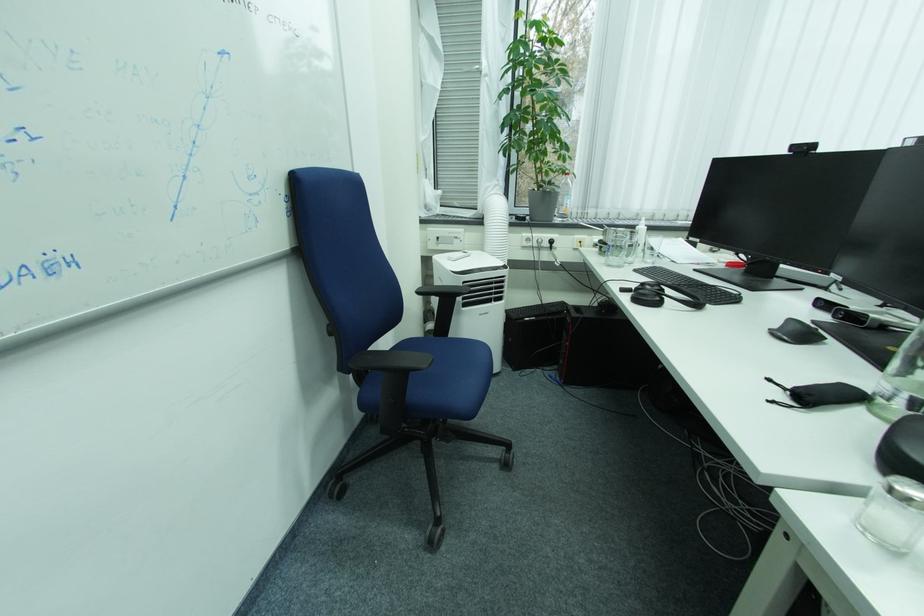
Locate an element on the screen. The image size is (924, 616). black drawstring pouch is located at coordinates (819, 395).